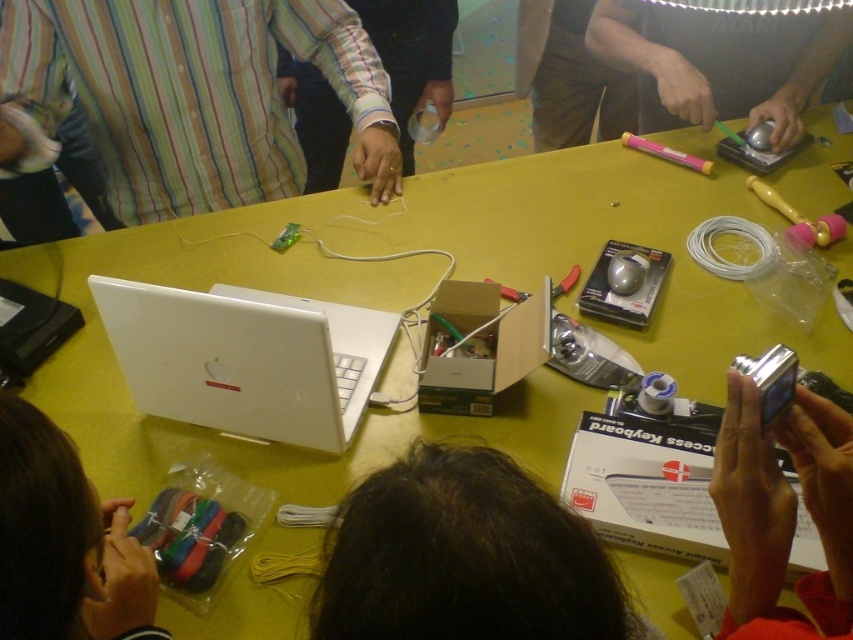
You are standing at the center of the image and want to reach the striped fabric shirt at upper left. Which direction should you move to get closer to it?

To reach the striped fabric shirt at upper left, you should move towards the upper left direction since it is located at point (196, 93) which is in the upper left area of the image.

You are a participant in the electronics workshop and need to reach both the metallic silver mouse at center and the yellow rubber duster at upper right. Given that your arm can comfortably reach 12 inches, will you be able to grab both items without moving your chair?

The metallic silver mouse at center is 11.63 inches away from the yellow rubber duster at upper right. Since your arm can reach 12 inches, you can comfortably grab both items without moving your chair.

You are a photographer taking a picture of the scene. You notice the striped fabric shirt at upper left and the white matte wristband at center. Which object is closer to the camera?

The striped fabric shirt at upper left is positioned under the white matte wristband at center, so the white matte wristband at center is closer to the camera.